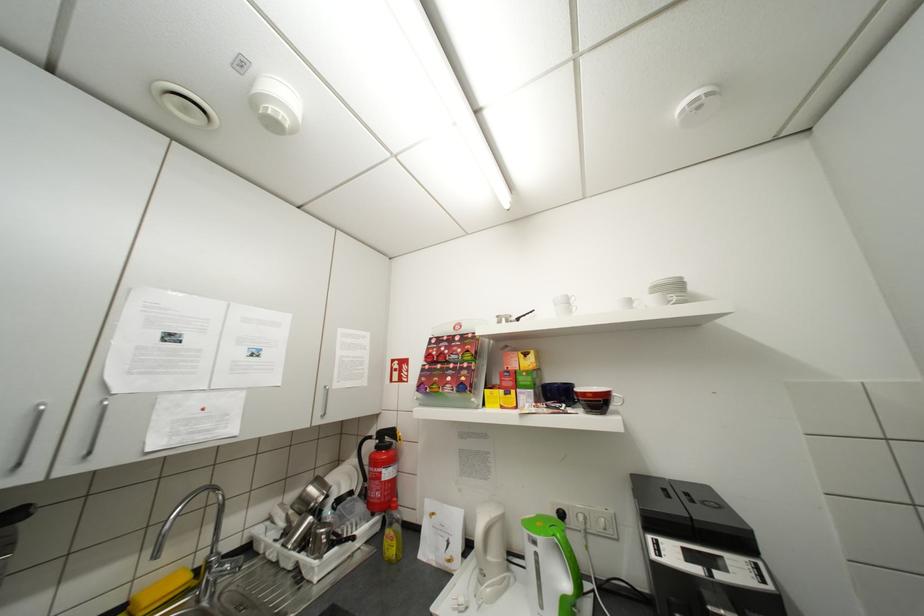
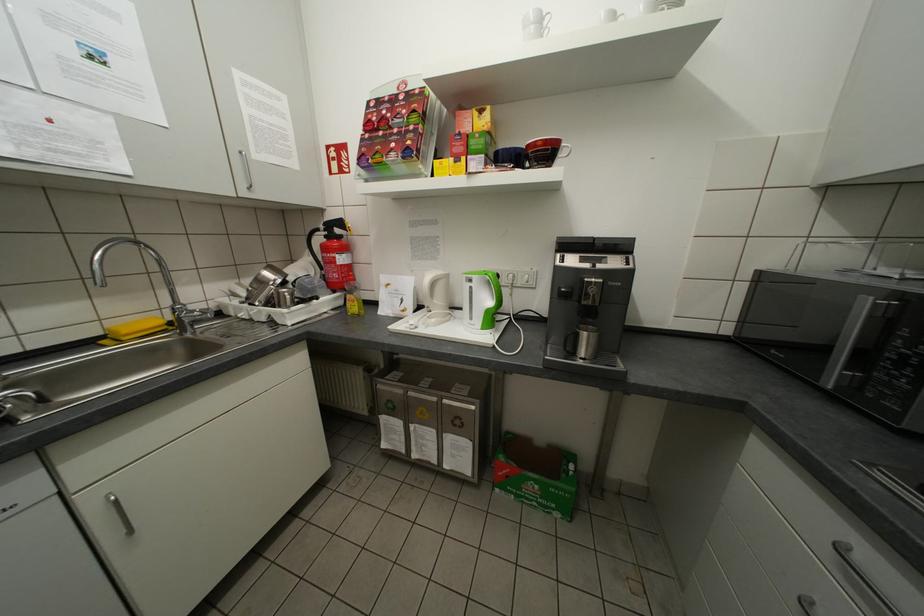
Locate, in the second image, the point that corresponds to pixel 327 414 in the first image.

(251, 185)